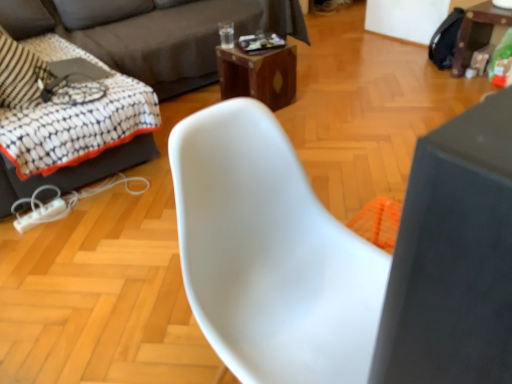
Question: From the image's perspective, does white plastic swivel chair at left appear higher than dark gray fabric couch at upper left, which is counted as the 2th studio couch, starting from the right?

Choices:
 (A) no
 (B) yes

Answer: (A)

Question: From a real-world perspective, is white plastic swivel chair at left over dark gray fabric couch at upper left, which is counted as the 2th studio couch, starting from the right?

Choices:
 (A) yes
 (B) no

Answer: (B)

Question: Is white plastic swivel chair at left not within dark gray fabric couch at upper left, positioned as the first studio couch in left-to-right order?

Choices:
 (A) yes
 (B) no

Answer: (B)

Question: Can you confirm if white plastic swivel chair at left is wider than dark gray fabric couch at upper left, which is counted as the 2th studio couch, starting from the right?

Choices:
 (A) no
 (B) yes

Answer: (A)

Question: Considering the relative sizes of white plastic swivel chair at left and dark gray fabric couch at upper left, which is counted as the 2th studio couch, starting from the right, in the image provided, is white plastic swivel chair at left taller than dark gray fabric couch at upper left, which is counted as the 2th studio couch, starting from the right,?

Choices:
 (A) yes
 (B) no

Answer: (B)

Question: In terms of size, does white plastic chair at center appear bigger or smaller than dark gray fabric couch at upper left, which appears as the 1th studio couch when viewed from the right?

Choices:
 (A) small
 (B) big

Answer: (A)

Question: Choose the correct answer: Is white plastic chair at center inside dark gray fabric couch at upper left, placed as the second studio couch when sorted from left to right, or outside it?

Choices:
 (A) outside
 (B) inside

Answer: (A)

Question: From their relative heights in the image, would you say white plastic chair at center is taller or shorter than dark gray fabric couch at upper left, placed as the second studio couch when sorted from left to right?

Choices:
 (A) tall
 (B) short

Answer: (A)

Question: From the image's perspective, is white plastic chair at center above or below dark gray fabric couch at upper left, which appears as the 1th studio couch when viewed from the right?

Choices:
 (A) above
 (B) below

Answer: (B)

Question: From the image's perspective, is white plastic swivel chair at left positioned above or below wooden table at right, the first table viewed from the right?

Choices:
 (A) above
 (B) below

Answer: (B)

Question: From a real-world perspective, is white plastic swivel chair at left above or below wooden table at right, the 2th table positioned from the left?

Choices:
 (A) below
 (B) above

Answer: (B)

Question: Considering their positions, is white plastic swivel chair at left located in front of or behind wooden table at right, the 2th table positioned from the left?

Choices:
 (A) front
 (B) behind

Answer: (A)

Question: Considering the positions of point (94, 135) and point (463, 39), is point (94, 135) closer or farther from the camera than point (463, 39)?

Choices:
 (A) farther
 (B) closer

Answer: (B)

Question: From a real-world perspective, is woodenmaterial/texturetable at center, which is counted as the 2th table, starting from the right, physically located above or below wooden table at right, the first table viewed from the right?

Choices:
 (A) below
 (B) above

Answer: (A)

Question: In terms of height, does woodenmaterial/texturetable at center, which appears as the 1th table when viewed from the left, look taller or shorter compared to wooden table at right, the first table viewed from the right?

Choices:
 (A) short
 (B) tall

Answer: (A)